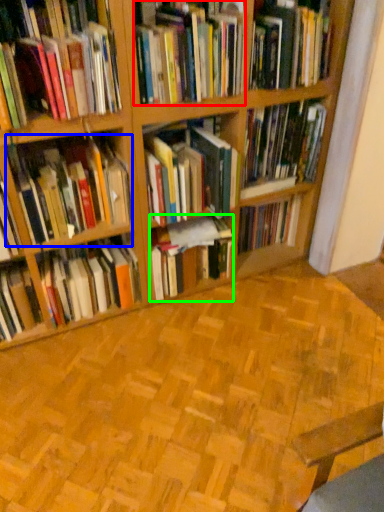
Question: Considering the real-world distances, which object is farthest from book (highlighted by a red box)? book (highlighted by a blue box) or book (highlighted by a green box)?

Choices:
 (A) book
 (B) book

Answer: (B)